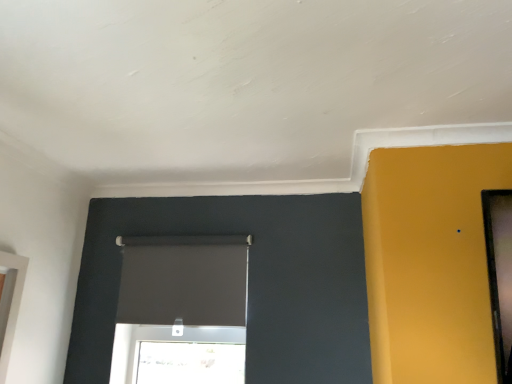
What do you see at coordinates (12, 307) in the screenshot? I see `white glossy window at left, which is the 2th window in right-to-left order` at bounding box center [12, 307].

Locate an element on the screen. This screenshot has height=384, width=512. white glossy window at left, which appears as the 2th window when viewed from the back is located at coordinates (12, 307).

You are a GUI agent. You are given a task and a screenshot of the screen. Output one action in this format:
    pyautogui.click(x=<x>, y=<y>)
    Task: Click on the matte black roller blind at center, which appears as the 1th window when viewed from the right
    The height and width of the screenshot is (384, 512).
    Given the screenshot: What is the action you would take?
    (181, 310)

Measure the distance between matte black roller blind at center, the second window in the left-to-right sequence, and camera.

1.85 meters.

What is the approximate width of matte black roller blind at center, the first window from the back?

It is 2.53 inches.

The image size is (512, 384). Describe the element at coordinates (181, 310) in the screenshot. I see `matte black roller blind at center, the first window from the back` at that location.

You are a GUI agent. You are given a task and a screenshot of the screen. Output one action in this format:
    pyautogui.click(x=<x>, y=<y>)
    Task: Click on the white glossy window at left, the 1th window viewed from the front
    This screenshot has width=512, height=384.
    Given the screenshot: What is the action you would take?
    pyautogui.click(x=12, y=307)

Which is more to the right, matte black roller blind at center, the 2th window when ordered from front to back, or white glossy window at left, which is the 1th window from left to right?

matte black roller blind at center, the 2th window when ordered from front to back, is more to the right.

Is matte black roller blind at center, which appears as the 1th window when viewed from the right, in front of white glossy window at left, the 1th window viewed from the front?

No, it is behind white glossy window at left, the 1th window viewed from the front.

Considering the positions of points (205, 237) and (11, 257), is point (205, 237) farther from camera compared to point (11, 257)?

Yes, it is behind point (11, 257).

From the image's perspective, is matte black roller blind at center, which appears as the 1th window when viewed from the right, on white glossy window at left, which appears as the 2th window when viewed from the back?

Yes, from the image's perspective, matte black roller blind at center, which appears as the 1th window when viewed from the right, is over white glossy window at left, which appears as the 2th window when viewed from the back.

From a real-world perspective, does matte black roller blind at center, the second window in the left-to-right sequence, stand above white glossy window at left, which is the 2th window in right-to-left order?

Yes, from a real-world perspective, matte black roller blind at center, the second window in the left-to-right sequence, is on top of white glossy window at left, which is the 2th window in right-to-left order.

Considering the relative sizes of matte black roller blind at center, the second window in the left-to-right sequence, and white glossy window at left, which is the 1th window from left to right, in the image provided, is matte black roller blind at center, the second window in the left-to-right sequence, thinner than white glossy window at left, which is the 1th window from left to right,?

Yes.

Which of these two, matte black roller blind at center, which appears as the 1th window when viewed from the right, or white glossy window at left, which is the 2th window in right-to-left order, stands shorter?

With less height is matte black roller blind at center, which appears as the 1th window when viewed from the right.

Considering the sizes of matte black roller blind at center, the 2th window when ordered from front to back, and white glossy window at left, which is the 2th window in right-to-left order, in the image, is matte black roller blind at center, the 2th window when ordered from front to back, bigger or smaller than white glossy window at left, which is the 2th window in right-to-left order,?

Considering their sizes, matte black roller blind at center, the 2th window when ordered from front to back, takes up more space than white glossy window at left, which is the 2th window in right-to-left order.

Is white glossy window at left, which appears as the 2th window when viewed from the back, inside matte black roller blind at center, which appears as the 1th window when viewed from the right?

No, white glossy window at left, which appears as the 2th window when viewed from the back, is not surrounded by matte black roller blind at center, which appears as the 1th window when viewed from the right.

Is matte black roller blind at center, the first window from the back, with white glossy window at left, the 1th window viewed from the front?

No, matte black roller blind at center, the first window from the back, is not beside white glossy window at left, the 1th window viewed from the front.

Is matte black roller blind at center, the first window from the back, oriented towards white glossy window at left, the 1th window viewed from the front?

Yes, matte black roller blind at center, the first window from the back, is facing white glossy window at left, the 1th window viewed from the front.

What's the angular difference between matte black roller blind at center, the 2th window when ordered from front to back, and white glossy window at left, which is the 1th window from left to right,'s facing directions?

They differ by 93.7 degrees in their facing directions.

Identify the location of window lying in front of the matte black roller blind at center, the second window in the left-to-right sequence. The height and width of the screenshot is (384, 512). (12, 307).

Considering the relative positions of white glossy window at left, which is the 2th window in right-to-left order, and matte black roller blind at center, the second window in the left-to-right sequence, in the image provided, is white glossy window at left, which is the 2th window in right-to-left order, to the right of matte black roller blind at center, the second window in the left-to-right sequence, from the viewer's perspective?

In fact, white glossy window at left, which is the 2th window in right-to-left order, is to the left of matte black roller blind at center, the second window in the left-to-right sequence.

Relative to matte black roller blind at center, the first window from the back, is white glossy window at left, the 1th window viewed from the front, in front or behind?

white glossy window at left, the 1th window viewed from the front, is positioned closer to the viewer than matte black roller blind at center, the first window from the back.

Which point is more forward, (10, 260) or (160, 377)?

The point (10, 260) is more forward.

From the image's perspective, does white glossy window at left, which is the 2th window in right-to-left order, appear lower than matte black roller blind at center, the first window from the back?

Indeed, from the image's perspective, white glossy window at left, which is the 2th window in right-to-left order, is shown beneath matte black roller blind at center, the first window from the back.

From the picture: From a real-world perspective, who is located lower, white glossy window at left, the 1th window viewed from the front, or matte black roller blind at center, which appears as the 1th window when viewed from the right?

white glossy window at left, the 1th window viewed from the front.

Which of these two, white glossy window at left, which is the 1th window from left to right, or matte black roller blind at center, the second window in the left-to-right sequence, is thinner?

With smaller width is matte black roller blind at center, the second window in the left-to-right sequence.

Can you confirm if white glossy window at left, which is the 2th window in right-to-left order, is taller than matte black roller blind at center, the second window in the left-to-right sequence?

Correct, white glossy window at left, which is the 2th window in right-to-left order, is much taller as matte black roller blind at center, the second window in the left-to-right sequence.

Between white glossy window at left, which is the 1th window from left to right, and matte black roller blind at center, the first window from the back, which one has smaller size?

With smaller size is white glossy window at left, which is the 1th window from left to right.

Is matte black roller blind at center, the second window in the left-to-right sequence, surrounded by white glossy window at left, which appears as the 2th window when viewed from the back?

No, matte black roller blind at center, the second window in the left-to-right sequence, is located outside of white glossy window at left, which appears as the 2th window when viewed from the back.

Is there a large distance between white glossy window at left, the 1th window viewed from the front, and matte black roller blind at center, the first window from the back?

No, there isn't a large distance between white glossy window at left, the 1th window viewed from the front, and matte black roller blind at center, the first window from the back.

Is matte black roller blind at center, the 2th window when ordered from front to back, at the back of white glossy window at left, the 1th window viewed from the front?

No, white glossy window at left, the 1th window viewed from the front, is not facing away from matte black roller blind at center, the 2th window when ordered from front to back.

How much distance is there between white glossy window at left, the 1th window viewed from the front, and matte black roller blind at center, the first window from the back?

white glossy window at left, the 1th window viewed from the front, is 25.48 inches away from matte black roller blind at center, the first window from the back.

The height and width of the screenshot is (384, 512). I want to click on window above the white glossy window at left, which is the 1th window from left to right (from the image's perspective), so click(181, 310).

Identify the location of window to the right of white glossy window at left, which is the 1th window from left to right. (181, 310).

Image resolution: width=512 pixels, height=384 pixels. Find the location of `window below the matte black roller blind at center, the 2th window when ordered from front to back (from a real-world perspective)`. window below the matte black roller blind at center, the 2th window when ordered from front to back (from a real-world perspective) is located at coordinates (12, 307).